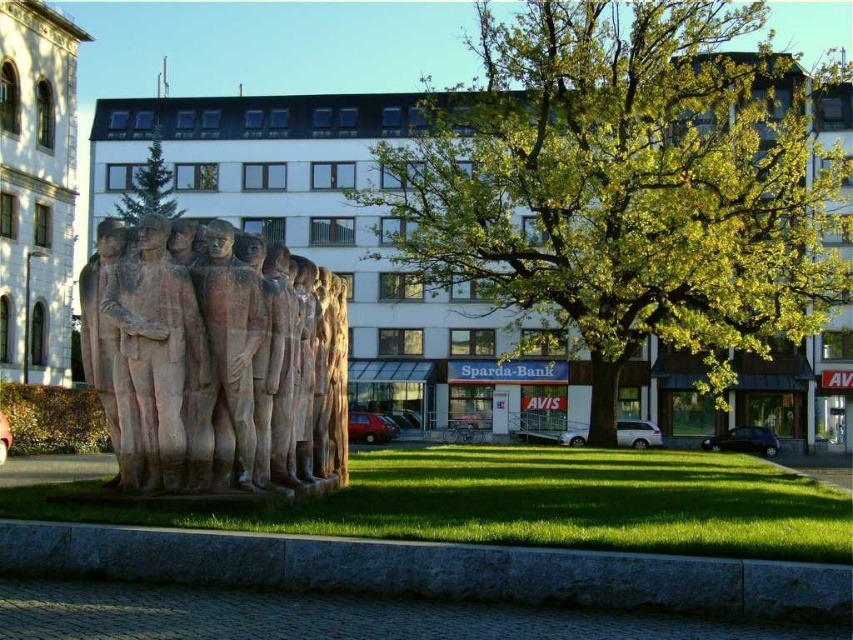
In the scene shown: Is the position of smooth stone statue at center more distant than that of green leafy tree at upper center?

No, it is in front of green leafy tree at upper center.

Between smooth stone statue at center and green leafy tree at upper center, which one appears on the left side from the viewer's perspective?

green leafy tree at upper center

Does point (251, 465) come in front of point (151, 173)?

Yes, it is.

Image resolution: width=853 pixels, height=640 pixels. I want to click on smooth stone statue at center, so click(x=230, y=348).

Is green leafy tree at center to the right of rustic stone statues at center from the viewer's perspective?

Correct, you'll find green leafy tree at center to the right of rustic stone statues at center.

Measure the distance from green leafy tree at center to rustic stone statues at center.

green leafy tree at center is 35.06 meters away from rustic stone statues at center.

Is point (506, 64) farther from camera compared to point (132, 365)?

Yes, point (506, 64) is farther from viewer.

Identify the location of green leafy tree at center. This screenshot has height=640, width=853. (628, 188).

Is green leafy tree at center taller than rustic stone sculpture at center?

Correct, green leafy tree at center is much taller as rustic stone sculpture at center.

Who is shorter, green leafy tree at center or rustic stone sculpture at center?

Standing shorter between the two is rustic stone sculpture at center.

Which is behind, point (451, 218) or point (128, 376)?

The point (451, 218) is more distant.

Where is `green leafy tree at center`? The height and width of the screenshot is (640, 853). green leafy tree at center is located at coordinates (628, 188).